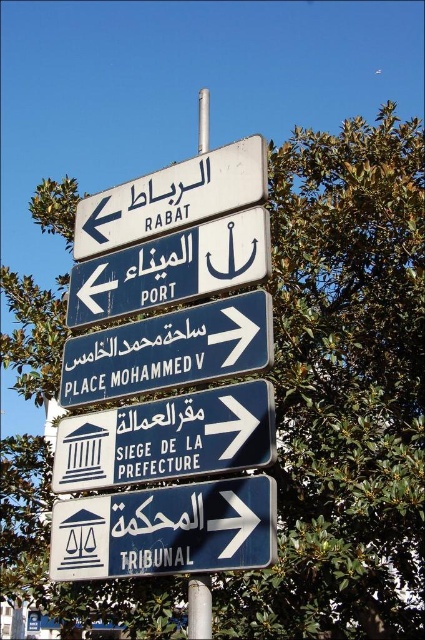
You are a delivery driver who needs to place a rectangular box between the blue metallic sign at center and the white plastic sign at upper center. The box is 1.5 meters long. Can you fit the box vertically between them without tilting it?

The blue metallic sign at center and white plastic sign at upper center are 1.54 meters apart from each other. Since the box is 1.5 meters long, it can fit vertically between them as the distance is slightly larger than the box length.

You are standing at the intersection and see two points marked on the road ahead. The first point is labeled as point (209, 336) and the second as point (204, 608). According to the road signs, which point is closer to the direction of Rabat?

Point (209, 336) is behind point (204, 608), so the direction of Rabat would be closer to point (204, 608) since it is in front.

You are standing at the point indicated by the coordinates point (169, 349). Which direction should you walk to reach the blue metallic sign at center?

The point (169, 349) indicates the blue metallic sign at center, so you are already at the location of the blue metallic sign at center.